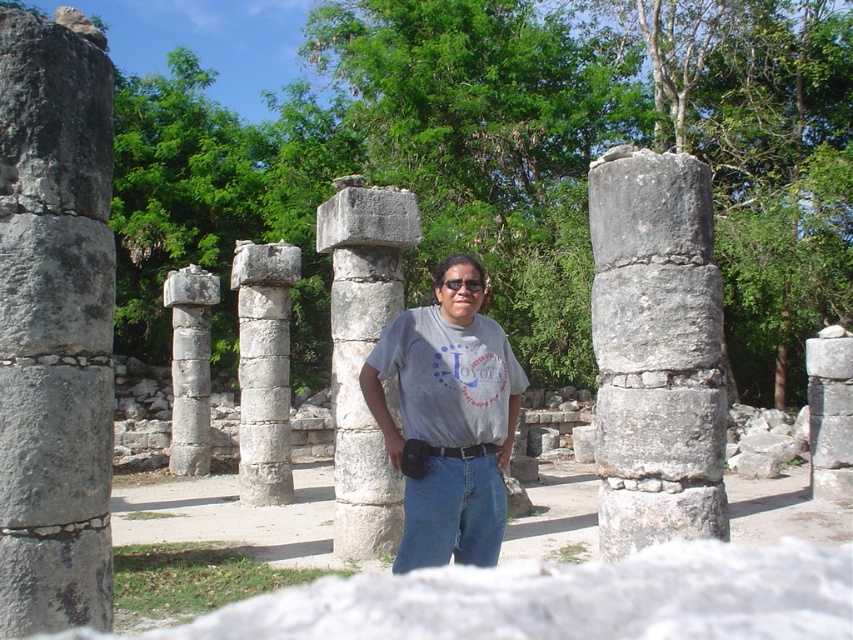
Question: Is smooth stone column at right in front of black matte sunglasses at center?

Choices:
 (A) yes
 (B) no

Answer: (B)

Question: Which of the following is the closest to the observer?

Choices:
 (A) smooth stone column at center
 (B) smooth stone column at right

Answer: (B)

Question: Where is gray stone column at right located in relation to smooth stone column at right in the image?

Choices:
 (A) above
 (B) below

Answer: (A)

Question: Based on their relative distances, which object is farther from the white stone column at center?

Choices:
 (A) gray cotton t-shirt at center
 (B) black matte sunglasses at center

Answer: (A)

Question: Which point appears closest to the camera in this image?

Choices:
 (A) [177, 305]
 (B) [239, 307]
 (C) [419, 547]
 (D) [811, 385]

Answer: (C)

Question: Is smooth stone column at right further to camera compared to black matte sunglasses at center?

Choices:
 (A) yes
 (B) no

Answer: (A)